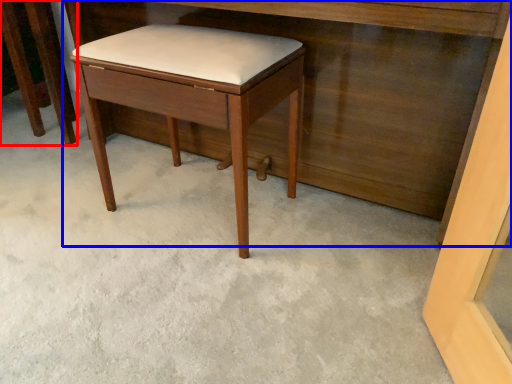
Question: Which point is closer to the camera, furniture (highlighted by a red box) or vanity (highlighted by a blue box)?

Choices:
 (A) furniture
 (B) vanity

Answer: (B)